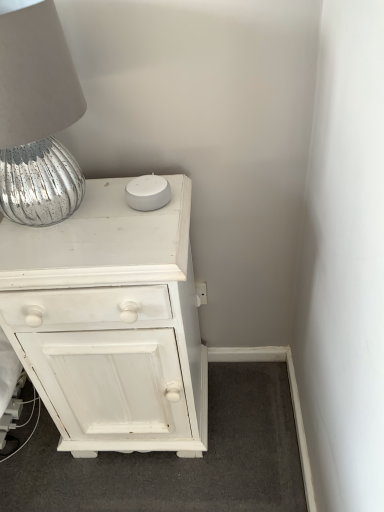
Question: Which is correct: white painted wood chest of drawers at upper left is inside silver textured lampshade at upper left, or outside of it?

Choices:
 (A) outside
 (B) inside

Answer: (A)

Question: Considering the relative positions of white painted wood chest of drawers at upper left and silver textured lampshade at upper left in the image provided, is white painted wood chest of drawers at upper left to the left or to the right of silver textured lampshade at upper left?

Choices:
 (A) right
 (B) left

Answer: (A)

Question: From the image's perspective, is white painted wood chest of drawers at upper left located above or below silver textured lampshade at upper left?

Choices:
 (A) below
 (B) above

Answer: (A)

Question: In terms of size, does silver textured lampshade at upper left appear bigger or smaller than white painted wood chest of drawers at upper left?

Choices:
 (A) big
 (B) small

Answer: (B)

Question: Do you think silver textured lampshade at upper left is within white painted wood chest of drawers at upper left, or outside of it?

Choices:
 (A) inside
 (B) outside

Answer: (B)

Question: From the image's perspective, is silver textured lampshade at upper left above or below white painted wood chest of drawers at upper left?

Choices:
 (A) above
 (B) below

Answer: (A)

Question: Considering the positions of silver textured lampshade at upper left and white painted wood chest of drawers at upper left in the image, is silver textured lampshade at upper left wider or thinner than white painted wood chest of drawers at upper left?

Choices:
 (A) thin
 (B) wide

Answer: (A)